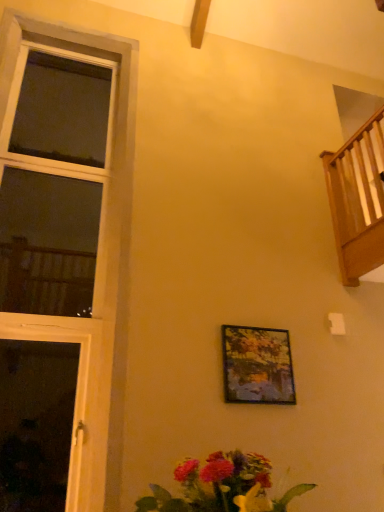
Question: Does vibrant bouquet at lower center have a greater height compared to wooden railing at upper right?

Choices:
 (A) yes
 (B) no

Answer: (B)

Question: Can you confirm if vibrant bouquet at lower center is shorter than wooden railing at upper right?

Choices:
 (A) no
 (B) yes

Answer: (B)

Question: Is vibrant bouquet at lower center facing towards wooden railing at upper right?

Choices:
 (A) yes
 (B) no

Answer: (B)

Question: Can you confirm if vibrant bouquet at lower center is smaller than wooden railing at upper right?

Choices:
 (A) no
 (B) yes

Answer: (B)

Question: Would you say vibrant bouquet at lower center is outside wooden railing at upper right?

Choices:
 (A) yes
 (B) no

Answer: (A)

Question: Does vibrant bouquet at lower center have a lesser width compared to wooden railing at upper right?

Choices:
 (A) no
 (B) yes

Answer: (A)

Question: Is wooden window at left bigger than vibrant bouquet at lower center?

Choices:
 (A) no
 (B) yes

Answer: (B)

Question: From a real-world perspective, is wooden window at left located higher than vibrant bouquet at lower center?

Choices:
 (A) no
 (B) yes

Answer: (B)

Question: Is wooden window at left smaller than vibrant bouquet at lower center?

Choices:
 (A) yes
 (B) no

Answer: (B)

Question: Can you confirm if wooden window at left is taller than vibrant bouquet at lower center?

Choices:
 (A) yes
 (B) no

Answer: (A)

Question: Can you confirm if wooden window at left is shorter than vibrant bouquet at lower center?

Choices:
 (A) yes
 (B) no

Answer: (B)

Question: Is wooden window at left further to the viewer compared to vibrant bouquet at lower center?

Choices:
 (A) no
 (B) yes

Answer: (B)

Question: From a real-world perspective, is wooden railing at upper right positioned over wooden window at left based on gravity?

Choices:
 (A) yes
 (B) no

Answer: (A)